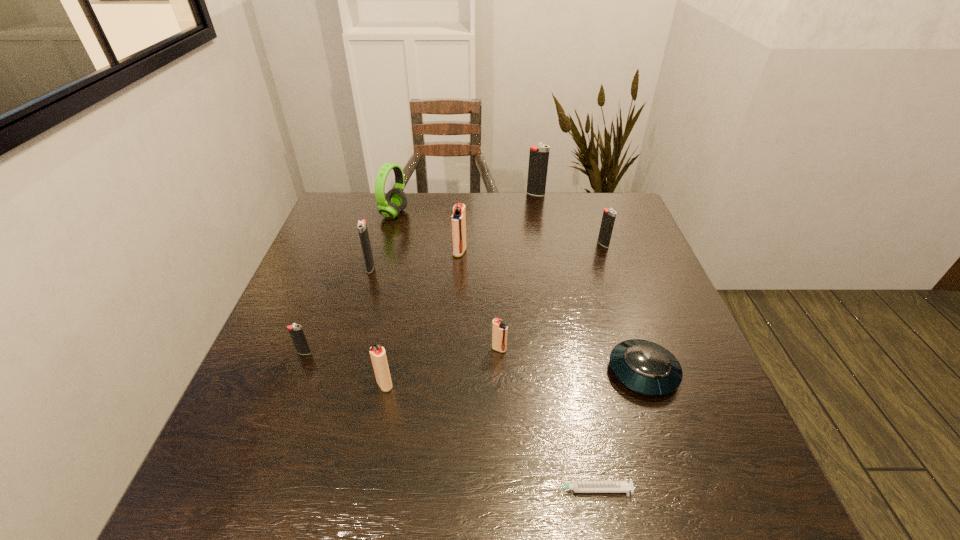
Locate an element on the screen. free space located at the needle end of the nearest object is located at coordinates (372, 490).

Identify the location of vacant region located at the needle end of the nearest object. (361, 490).

Locate an element on the screen. igniter situated at the far edge is located at coordinates (539, 155).

The width and height of the screenshot is (960, 540). I want to click on headset that is at the far edge, so click(x=396, y=200).

Where is `object present at the near edge`? The height and width of the screenshot is (540, 960). object present at the near edge is located at coordinates 577,486.

Find the location of a particular element. This screenshot has height=540, width=960. object that is at the left edge is located at coordinates (295, 330).

You are a GUI agent. You are given a task and a screenshot of the screen. Output one action in this format:
    pyautogui.click(x=<x>, y=<y>)
    Task: Click on the igniter located at the right edge
    The height and width of the screenshot is (540, 960).
    Given the screenshot: What is the action you would take?
    pyautogui.click(x=609, y=215)

Image resolution: width=960 pixels, height=540 pixels. I want to click on saucer present at the right edge, so click(x=645, y=367).

The image size is (960, 540). In the image, there is a desktop. Identify the location of free space at the far edge. (560, 204).

In the image, there is a desktop. In order to click on vacant area at the near edge in this screenshot , I will do (x=469, y=486).